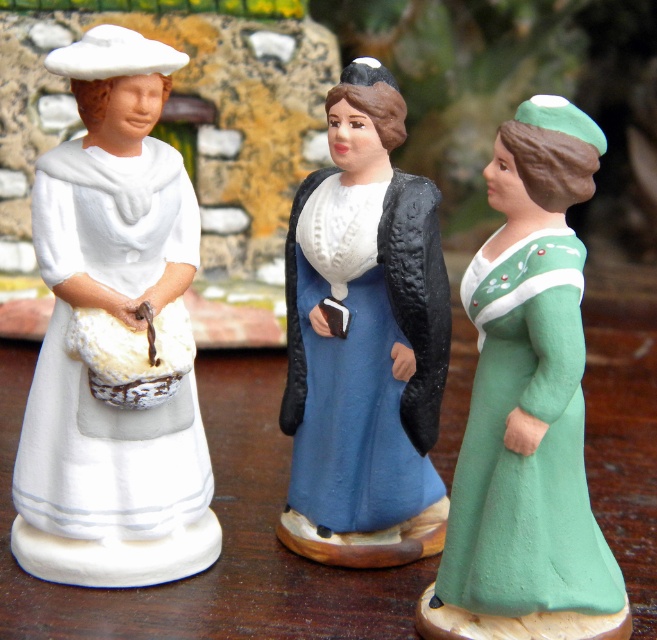
You are standing in front of the three figurines on the wooden surface. Which of the two center figurines, the green matte dress at center or the blue matte dress at center, is closer to you?

The green matte dress at center is closer to you because it is positioned in front of the blue matte dress at center.

You are an art curator arranging an exhibit. You need to ensure that the white matte porcelain figurine at left and the blue matte dress at center are positioned so that visitors can clearly see both. Based on their current arrangement, which figurine is closer to the visitors when they first enter the room?

The white matte porcelain figurine at left is closer to the visitors because it is positioned in front of the blue matte dress at center, making it more visible upon entering.